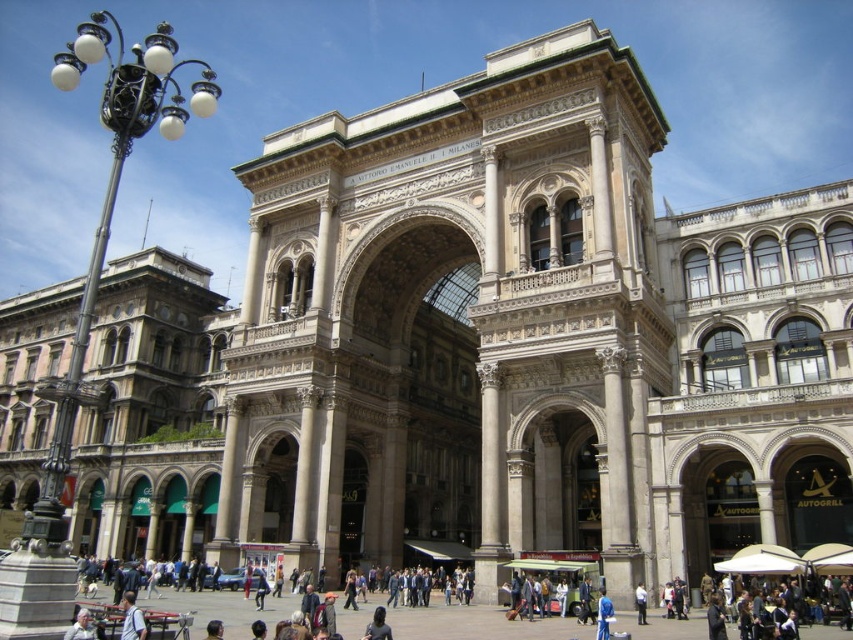
Question: Based on their relative distances, which object is farther from the dark brown hair at lower center?

Choices:
 (A) light gray fabric jacket at lower left
 (B) blue fabric jacket at lower center
 (C) blue fabric shirt at center

Answer: (C)

Question: Which is nearer to the blue fabric shirt at center?

Choices:
 (A) black wrought iron streetlight at left
 (B) light blue shirt at center
 (C) blue fabric jacket at lower center
 (D) light gray fabric jacket at lower left

Answer: (C)

Question: Which of these objects is positioned farthest from the blue fabric shirt at center?

Choices:
 (A) blue fabric jacket at lower center
 (B) dark brown hair at lower center
 (C) light gray fabric jacket at lower left

Answer: (C)

Question: Can you confirm if light gray fabric jacket at lower left is positioned above dark brown hair at lower center?

Choices:
 (A) yes
 (B) no

Answer: (A)

Question: Can you confirm if dark brown hair at lower center is smaller than blue fabric shirt at center?

Choices:
 (A) yes
 (B) no

Answer: (B)

Question: Is blue fabric jacket at lower center behind blue fabric shirt at center?

Choices:
 (A) no
 (B) yes

Answer: (A)